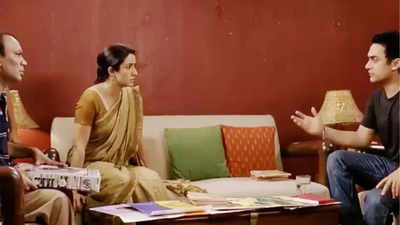
This screenshot has width=400, height=225. I want to click on empty wall, so click(x=210, y=51).